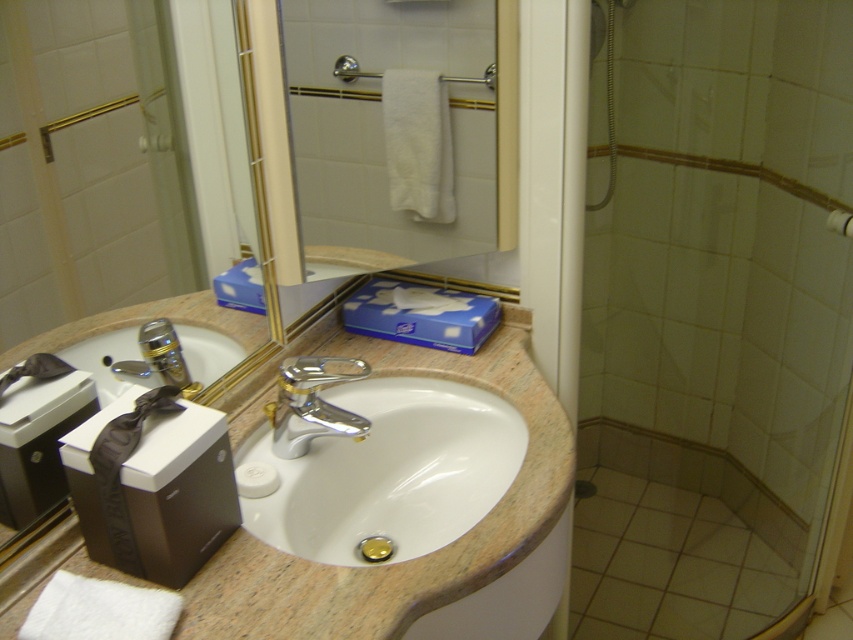
Between transparent glass shower door at right and white matte towel bar at upper center, which one appears on the right side from the viewer's perspective?

white matte towel bar at upper center is more to the right.

Does transparent glass shower door at right appear over white matte towel bar at upper center?

Incorrect, transparent glass shower door at right is not positioned above white matte towel bar at upper center.

This screenshot has height=640, width=853. Identify the location of transparent glass shower door at right. (715, 317).

Can you confirm if metallic gold mirror at center is shorter than white glossy sink at center?

Incorrect, metallic gold mirror at center's height does not fall short of white glossy sink at center's.

Is point (320, 291) less distant than point (361, 460)?

No, it is behind (361, 460).

This screenshot has height=640, width=853. I want to click on metallic gold mirror at center, so click(x=294, y=138).

Between metallic gold mirror at center and marble-like beige sink at center, which one appears on the left side from the viewer's perspective?

From the viewer's perspective, metallic gold mirror at center appears more on the left side.

How distant is metallic gold mirror at center from marble-like beige sink at center?

metallic gold mirror at center and marble-like beige sink at center are 9.73 inches apart from each other.

The image size is (853, 640). Identify the location of metallic gold mirror at center. (294, 138).